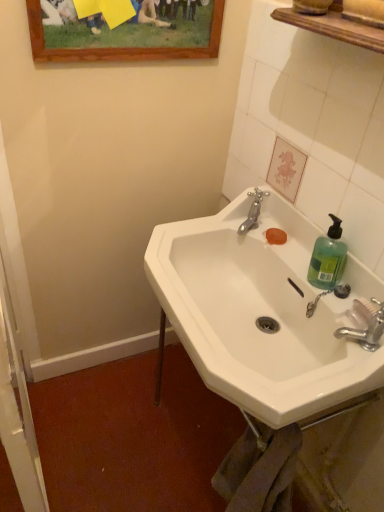
Question: From the image's perspective, is white ceramic sink at center on top of silver metallic faucet at upper center, placed as the second tap when sorted from right to left?

Choices:
 (A) no
 (B) yes

Answer: (A)

Question: Does white ceramic sink at center have a larger size compared to silver metallic faucet at upper center, the 2th tap in the bottom-to-top sequence?

Choices:
 (A) no
 (B) yes

Answer: (B)

Question: Is white ceramic sink at center facing away from silver metallic faucet at upper center, the first tap viewed from the top?

Choices:
 (A) no
 (B) yes

Answer: (B)

Question: From a real-world perspective, is white ceramic sink at center located beneath silver metallic faucet at upper center, placed as the second tap when sorted from right to left?

Choices:
 (A) no
 (B) yes

Answer: (B)

Question: Would you consider white ceramic sink at center to be distant from silver metallic faucet at upper center, placed as the first tap when sorted from back to front?

Choices:
 (A) yes
 (B) no

Answer: (B)

Question: Looking at the image, does green translucent plastic at right seem bigger or smaller compared to silver metallic faucet at upper center, the 1th tap positioned from the left?

Choices:
 (A) big
 (B) small

Answer: (A)

Question: Do you think green translucent plastic at right is within silver metallic faucet at upper center, the 1th tap positioned from the left, or outside of it?

Choices:
 (A) inside
 (B) outside

Answer: (B)

Question: From the image's perspective, is green translucent plastic at right above or below silver metallic faucet at upper center, placed as the second tap when sorted from right to left?

Choices:
 (A) above
 (B) below

Answer: (B)

Question: Considering the positions of green translucent plastic at right and silver metallic faucet at upper center, the 2th tap in the bottom-to-top sequence, in the image, is green translucent plastic at right taller or shorter than silver metallic faucet at upper center, the 2th tap in the bottom-to-top sequence,?

Choices:
 (A) tall
 (B) short

Answer: (A)

Question: From a real-world perspective, relative to white glossy screen door at left, is green translucent plastic at right vertically above or below?

Choices:
 (A) above
 (B) below

Answer: (A)

Question: In terms of size, does green translucent plastic at right appear bigger or smaller than white glossy screen door at left?

Choices:
 (A) big
 (B) small

Answer: (B)

Question: Is green translucent plastic at right inside the boundaries of white glossy screen door at left, or outside?

Choices:
 (A) inside
 (B) outside

Answer: (B)

Question: Is green translucent plastic at right in front of or behind white glossy screen door at left in the image?

Choices:
 (A) behind
 (B) front

Answer: (A)

Question: Looking at their shapes, would you say wooden picture frame at upper center is wider or thinner than silver metallic faucet at lower right, the second tap from the top?

Choices:
 (A) wide
 (B) thin

Answer: (B)

Question: Relative to silver metallic faucet at lower right, the second tap viewed from the left, is wooden picture frame at upper center in front or behind?

Choices:
 (A) behind
 (B) front

Answer: (A)